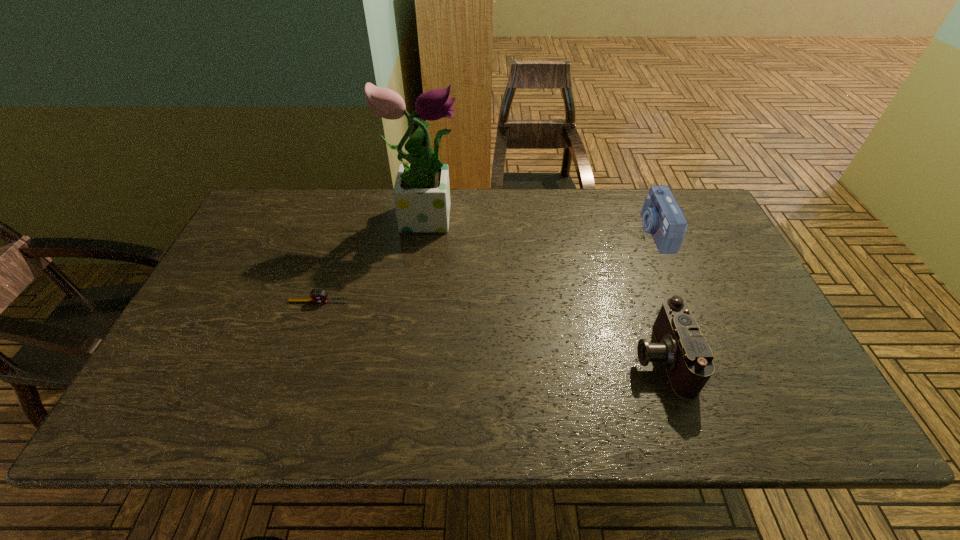
Where is `object that is at the far right corner`? object that is at the far right corner is located at coordinates (662, 217).

I want to click on free point at the far edge, so click(464, 209).

You are a GUI agent. You are given a task and a screenshot of the screen. Output one action in this format:
    pyautogui.click(x=<x>, y=<y>)
    Task: Click on the free region at the near edge of the desktop
    
    Given the screenshot: What is the action you would take?
    pyautogui.click(x=620, y=418)

The image size is (960, 540). I want to click on free space at the left edge of the desktop, so click(x=264, y=285).

Find the location of a particular element. This screenshot has width=960, height=540. vacant space at the right edge is located at coordinates (780, 339).

Image resolution: width=960 pixels, height=540 pixels. In the image, there is a desktop. Identify the location of vacant space at the far left corner. (273, 197).

In the image, there is a desktop. Identify the location of vacant space at the far right corner. The width and height of the screenshot is (960, 540). (687, 228).

Locate an element on the screen. The height and width of the screenshot is (540, 960). vacant space that's between the tape measure and the flower arrangement is located at coordinates (372, 258).

At what (x,y) coordinates should I click in order to perform the action: click on vacant point located between the tape measure and the flower arrangement. Please return your answer as a coordinate pair (x, y). The width and height of the screenshot is (960, 540). Looking at the image, I should click on (372, 258).

Identify the location of blank region between the right camera and the left camera. (658, 295).